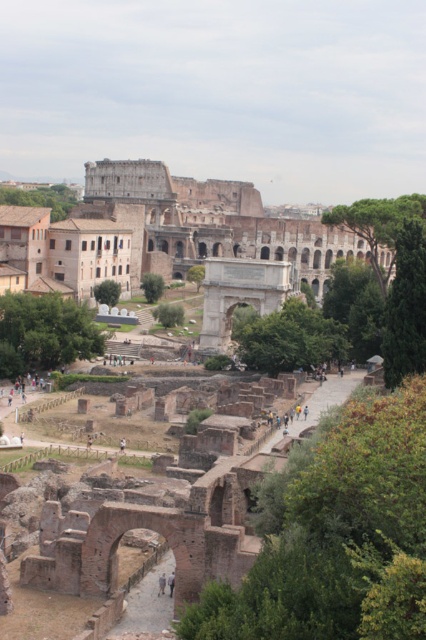
Question: Which object appears farthest from the camera in this image?

Choices:
 (A) light brown leather shoes at center
 (B) light brown leather jacket at center

Answer: (A)

Question: Does light brown leather shoes at center come in front of light brown leather jacket at center?

Choices:
 (A) no
 (B) yes

Answer: (A)

Question: Can you confirm if light brown leather shoes at center is wider than light brown leather jacket at center?

Choices:
 (A) no
 (B) yes

Answer: (B)

Question: Can you confirm if light brown leather shoes at center is positioned to the left of light brown leather jacket at center?

Choices:
 (A) no
 (B) yes

Answer: (B)

Question: Among these points, which one is farthest from the camera?

Choices:
 (A) (172, 573)
 (B) (163, 579)

Answer: (A)